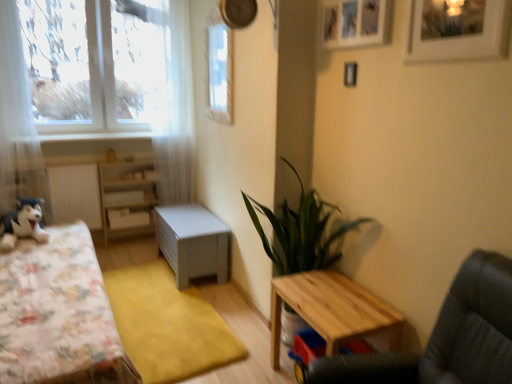
This screenshot has height=384, width=512. I want to click on white painted wood dresser at center, so click(x=127, y=197).

Measure the distance between point (x=159, y=331) and camera.

A distance of 2.61 meters exists between point (x=159, y=331) and camera.

Locate an element on the screen. This screenshot has width=512, height=384. black plush toy at left is located at coordinates (22, 223).

The image size is (512, 384). What do you see at coordinates (22, 223) in the screenshot?
I see `black plush toy at left` at bounding box center [22, 223].

Looking at this image, measure the distance between point (182, 218) and camera.

Point (182, 218) is 11.42 feet away from camera.

This screenshot has width=512, height=384. Describe the element at coordinates (355, 23) in the screenshot. I see `wooden picture frame at upper center, acting as the 1th picture frame starting from the left` at that location.

Where is `white painted wood dresser at center`? The height and width of the screenshot is (384, 512). white painted wood dresser at center is located at coordinates (127, 197).

Is yellow carpet at center oriented towards green leafy plant at center?

No, yellow carpet at center is not turned towards green leafy plant at center.

Is yellow carpet at center spatially inside green leafy plant at center, or outside of it?

yellow carpet at center is spatially situated outside green leafy plant at center.

Considering the relative positions of yellow carpet at center and green leafy plant at center in the image provided, is yellow carpet at center in front of green leafy plant at center?

No, yellow carpet at center is behind green leafy plant at center.

Between yellow carpet at center and green leafy plant at center, which one appears on the right side from the viewer's perspective?

Positioned to the right is green leafy plant at center.

Which of these two, fluffy fabric bed at left or clear plastic window screen at upper center, is bigger?

fluffy fabric bed at left.

From the image's perspective, between fluffy fabric bed at left and clear plastic window screen at upper center, which one is located above?

clear plastic window screen at upper center is shown above in the image.

In the scene shown: Are fluffy fabric bed at left and clear plastic window screen at upper center located far from each other?

Absolutely, fluffy fabric bed at left is distant from clear plastic window screen at upper center.

Can you confirm if fluffy fabric bed at left is shorter than clear plastic window screen at upper center?

In fact, fluffy fabric bed at left may be taller than clear plastic window screen at upper center.

From the image's perspective, is white painted wood dresser at center beneath green leafy plant at center?

No.

Between point (136, 169) and point (327, 214), which one is positioned behind?

The point (136, 169) is more distant.

From a real-world perspective, who is located lower, white painted wood dresser at center or green leafy plant at center?

From a 3D spatial view, white painted wood dresser at center is below.

Can you tell me how much white painted wood dresser at center and green leafy plant at center differ in facing direction?

The angular difference between white painted wood dresser at center and green leafy plant at center is 89.3 degrees.

Is point (378, 319) positioned after point (6, 125)?

No, (378, 319) is closer to viewer.

Which is correct: wooden table at lower right, placed as the first table when sorted from front to back, is inside white sheer curtain at left, the second curtain viewed from the right, or outside of it?

wooden table at lower right, placed as the first table when sorted from front to back, is not enclosed by white sheer curtain at left, the second curtain viewed from the right.

From a real-world perspective, relative to white sheer curtain at left, positioned as the 1th curtain in left-to-right order, is wooden table at lower right, the second table positioned from the left, vertically above or below?

In terms of real-world spatial position, wooden table at lower right, the second table positioned from the left, is below white sheer curtain at left, positioned as the 1th curtain in left-to-right order.

Which of these two, wooden table at lower right, the second table positioned from the left, or white sheer curtain at left, positioned as the 1th curtain in left-to-right order, is thinner?

white sheer curtain at left, positioned as the 1th curtain in left-to-right order.

From the image's perspective, would you say white matte picture frame at upper right, marked as the second picture frame in a back-to-front arrangement, is shown under wooden table at lower right, which is the second table in back-to-front order?

Actually, white matte picture frame at upper right, marked as the second picture frame in a back-to-front arrangement, appears above wooden table at lower right, which is the second table in back-to-front order, in the image.

Does white matte picture frame at upper right, marked as the second picture frame in a back-to-front arrangement, have a greater height compared to wooden table at lower right, the first table viewed from the right?

No, white matte picture frame at upper right, marked as the second picture frame in a back-to-front arrangement, is not taller than wooden table at lower right, the first table viewed from the right.

How distant is white matte picture frame at upper right, placed as the first picture frame when sorted from right to left, from wooden table at lower right, the first table viewed from the right?

The distance of white matte picture frame at upper right, placed as the first picture frame when sorted from right to left, from wooden table at lower right, the first table viewed from the right, is 4.03 feet.

This screenshot has width=512, height=384. What are the coordinates of `the 2nd picture frame to the right when counting from the wooden table at lower right, which is the second table in back-to-front order` in the screenshot? It's located at (458, 30).

Based on the photo, from the image's perspective, between white painted wood dresser at center and matte gray chest at center, which is the first table from left to right, who is located below?

matte gray chest at center, which is the first table from left to right, appears lower in the image.

Between white painted wood dresser at center and matte gray chest at center, the first table from the back, which one has larger width?

matte gray chest at center, the first table from the back, is wider.

In terms of height, does white painted wood dresser at center look taller or shorter compared to matte gray chest at center, which is the first table from left to right?

Considering their sizes, white painted wood dresser at center has more height than matte gray chest at center, which is the first table from left to right.

Is white painted wood dresser at center positioned beyond the bounds of matte gray chest at center, the second table positioned from the right?

Yes.

Starting from the fluffy fabric bed at left, which picture frame is the 2nd one behind? Please provide its 2D coordinates.

[(355, 23)]

Looking at this image, is fluffy fabric bed at left located within wooden picture frame at upper center, acting as the 1th picture frame starting from the left?

No, wooden picture frame at upper center, acting as the 1th picture frame starting from the left, does not contain fluffy fabric bed at left.

Considering the sizes of objects wooden picture frame at upper center, which ranks as the 2th picture frame in right-to-left order, and fluffy fabric bed at left in the image provided, who is bigger, wooden picture frame at upper center, which ranks as the 2th picture frame in right-to-left order, or fluffy fabric bed at left?

fluffy fabric bed at left is bigger.

Looking at their sizes, would you say wooden picture frame at upper center, which ranks as the 2th picture frame in right-to-left order, is wider or thinner than fluffy fabric bed at left?

In the image, wooden picture frame at upper center, which ranks as the 2th picture frame in right-to-left order, appears to be more narrow than fluffy fabric bed at left.

Where is `mat that appears below the green leafy plant at center (from a real-world perspective)`? The height and width of the screenshot is (384, 512). mat that appears below the green leafy plant at center (from a real-world perspective) is located at coordinates (167, 324).

I want to click on window screen behind the fluffy fabric bed at left, so click(218, 69).

Which object lies further to the anchor point clear plastic window screen at upper center, white sheer curtain at left, arranged as the first curtain when viewed from the front, or black plush toy at left?

black plush toy at left is positioned further to the anchor clear plastic window screen at upper center.

Based on the photo, based on their spatial positions, is matte gray chest at center, the first table from the back, or white matte picture frame at upper right, acting as the second picture frame starting from the left, further from wooden picture frame at upper center, placed as the second picture frame when sorted from front to back?

matte gray chest at center, the first table from the back, is positioned further to the anchor wooden picture frame at upper center, placed as the second picture frame when sorted from front to back.

From the image, which object appears to be farther from matte gray chest at center, which is the first table from left to right, wooden picture frame at upper center, acting as the 1th picture frame starting from the left, or clear plastic window screen at upper center?

wooden picture frame at upper center, acting as the 1th picture frame starting from the left, is positioned further to the anchor matte gray chest at center, which is the first table from left to right.

Estimate the real-world distances between objects in this image. Which object is further from white sheer curtain at left, the 2th curtain when ordered from back to front, yellow carpet at center or white painted wood dresser at center?

yellow carpet at center lies further to white sheer curtain at left, the 2th curtain when ordered from back to front, than the other object.

Estimate the real-world distances between objects in this image. Which object is closer to white matte drawer at center, wooden table at lower right, the first table viewed from the right, or yellow carpet at center?

yellow carpet at center.

From the image, which object appears to be farther from wooden picture frame at upper center, which is the 1th picture frame in back-to-front order, white matte picture frame at upper right, marked as the first picture frame in a front-to-back arrangement, or fluffy fabric bed at left?

Among the two, fluffy fabric bed at left is located further to wooden picture frame at upper center, which is the 1th picture frame in back-to-front order.

Considering their positions, is black plush toy at left positioned further to white sheer curtain at left, the 2th curtain when ordered from back to front, than wooden table at lower right, which is the second table in back-to-front order?

The object further to white sheer curtain at left, the 2th curtain when ordered from back to front, is wooden table at lower right, which is the second table in back-to-front order.

When comparing their distances from white matte picture frame at upper right, marked as the first picture frame in a front-to-back arrangement, does white sheer curtain at left, the second curtain viewed from the right, or fluffy fabric bed at left seem closer?

Among the two, fluffy fabric bed at left is located nearer to white matte picture frame at upper right, marked as the first picture frame in a front-to-back arrangement.

The height and width of the screenshot is (384, 512). I want to click on curtain between white sheer curtain at left, the 2th curtain when ordered from back to front, and wooden picture frame at upper center, which is the 1th picture frame in back-to-front order, in the horizontal direction, so click(x=174, y=106).

The height and width of the screenshot is (384, 512). What are the coordinates of `drawer between white sheer curtain at left, the second curtain viewed from the right, and clear plastic window screen at upper center from left to right` in the screenshot? It's located at (127, 218).

Identify the location of curtain situated between black plush toy at left and matte gray chest at center, the second table positioned from the right, from left to right. (174, 106).

Identify the location of houseplant between wooden picture frame at upper center, which ranks as the 2th picture frame in right-to-left order, and wooden swivel chair at lower right in the up-down direction. (302, 232).